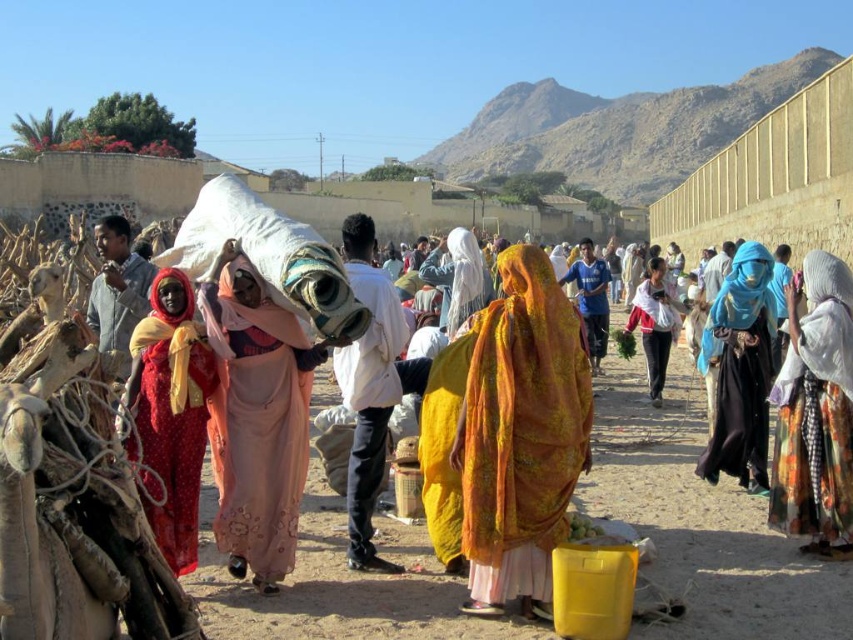
In the scene shown: You are a photographer at the market and want to capture both the matte pink dress at center and the floral fabric dress at center in the same frame. Which dress should you focus on first to ensure both are in the shot?

The matte pink dress at center is below the floral fabric dress at center, so you should focus on the floral fabric dress at center first to ensure both are in the shot.